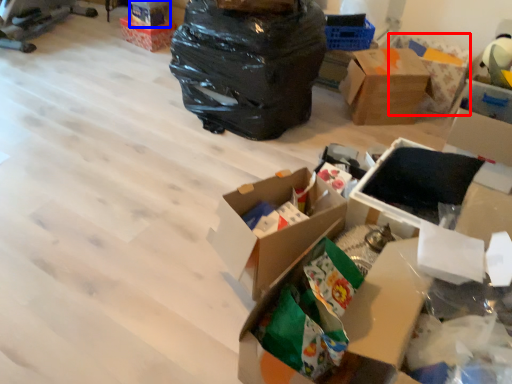
Question: Which point is further to the camera, cardboard box (highlighted by a red box) or storage box (highlighted by a blue box)?

Choices:
 (A) cardboard box
 (B) storage box

Answer: (B)